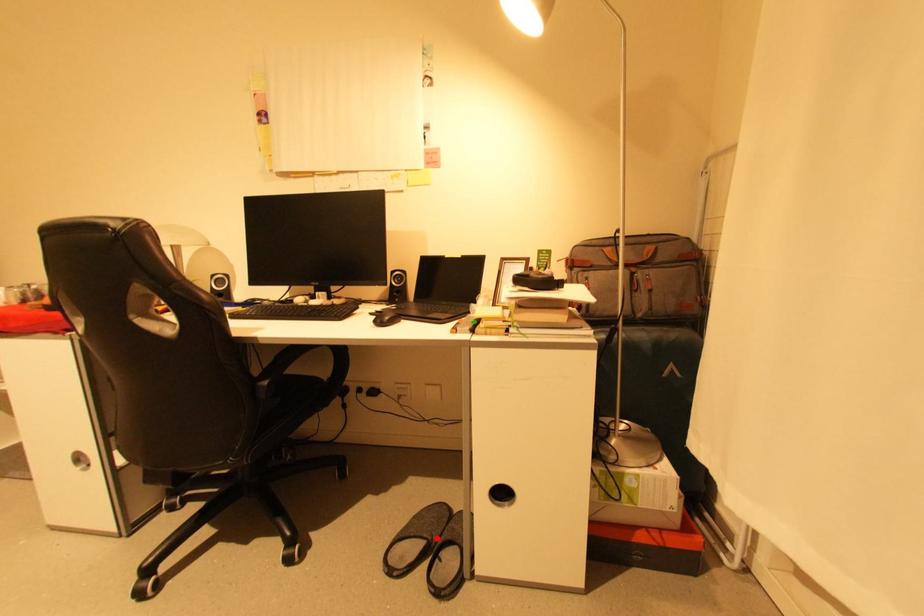
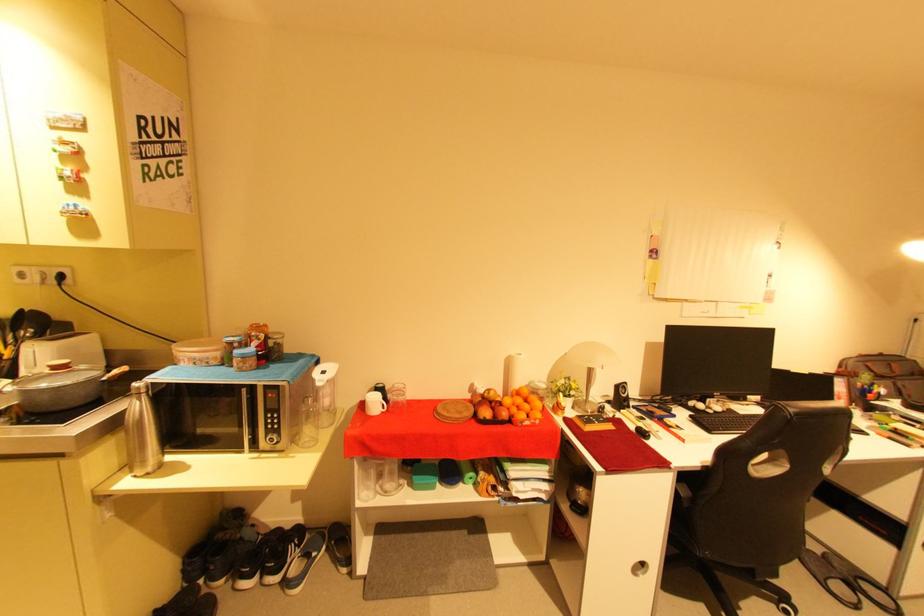
Question: I am providing you with two images of the same scene from different viewpoints. Image1 has a red point marked. In image2, the corresponding 3D location appears at what relative position? Reply with the corresponding letter.

Choices:
 (A) Closer
 (B) Farther

Answer: (A)